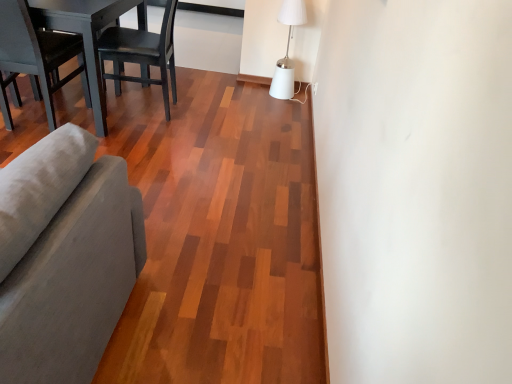
Question: Is gray fabric couch at left to the left or to the right of white matte table lamp at upper right in the image?

Choices:
 (A) right
 (B) left

Answer: (B)

Question: Considering the positions of point (57, 243) and point (289, 92), is point (57, 243) closer or farther from the camera than point (289, 92)?

Choices:
 (A) farther
 (B) closer

Answer: (B)

Question: Which object is the farthest from the gray fabric couch at left?

Choices:
 (A) dark wood table at left
 (B) matte gray chair at left, the first chair viewed from the left
 (C) black matte wood chair at upper left, positioned as the first chair in right-to-left order
 (D) white matte table lamp at upper right

Answer: (D)

Question: Which is nearer to the black matte wood chair at upper left, the second chair in the left-to-right sequence?

Choices:
 (A) gray fabric couch at left
 (B) dark wood table at left
 (C) white matte table lamp at upper right
 (D) matte gray chair at left, the first chair viewed from the left

Answer: (B)